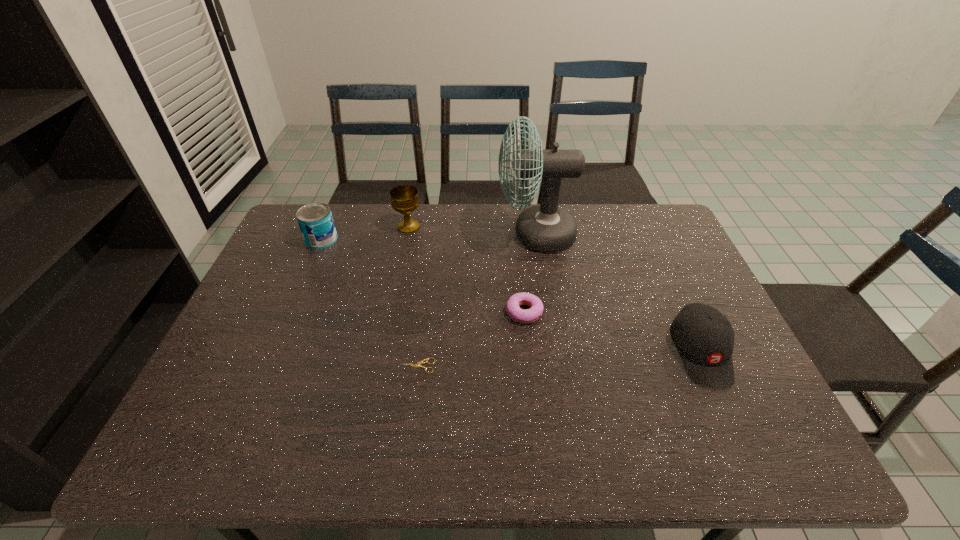
Find the location of a particular element. fan is located at coordinates (546, 228).

Identify the location of chalice. The height and width of the screenshot is (540, 960). (404, 199).

Locate an element on the screen. the leftmost object is located at coordinates (315, 220).

The width and height of the screenshot is (960, 540). Identify the location of the rightmost object. (704, 338).

This screenshot has width=960, height=540. I want to click on doughnut, so click(x=531, y=315).

Find the location of a particular element. the shortest object is located at coordinates (420, 362).

Locate an element on the screen. blank space located in front of the fan where the airflow is directed is located at coordinates (467, 235).

The height and width of the screenshot is (540, 960). In order to click on free space located 0.160m in front of the fan where the airflow is directed in this screenshot , I will do `click(448, 235)`.

Locate an element on the screen. This screenshot has width=960, height=540. vacant space positioned in front of the fan where the airflow is directed is located at coordinates coord(386,235).

The height and width of the screenshot is (540, 960). Find the location of `vacant space located 0.250m on the right of the chalice`. vacant space located 0.250m on the right of the chalice is located at coordinates (495, 227).